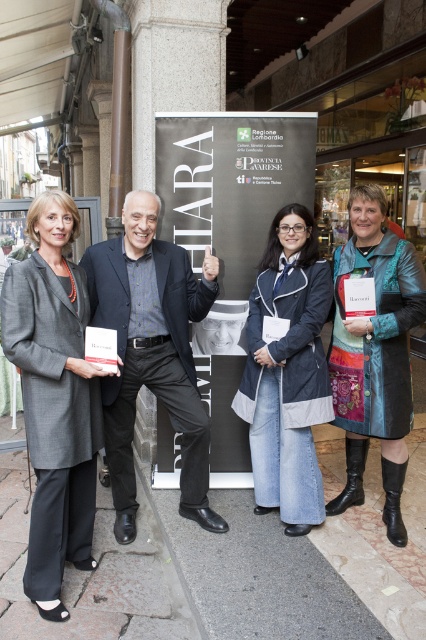
Does matte gray coat at center have a smaller size compared to dark gray suit at center?

Yes.

Is point (66, 230) more distant than point (131, 445)?

No, it is in front of (131, 445).

Is point (63, 376) closer to camera compared to point (126, 524)?

That is True.

Identify the location of matte gray coat at center. [x=54, y=397].

Is matte gray coat at center closer to camera compared to leather jacket at center?

Yes, it is.

Who is lower down, matte gray coat at center or leather jacket at center?

Positioned lower is matte gray coat at center.

Which is behind, point (37, 515) or point (340, 317)?

Positioned behind is point (340, 317).

Where is `matte gray coat at center`? matte gray coat at center is located at coordinates (54, 397).

Does white paper at center have a greater height compared to leather jacket at center?

Yes.

Does white paper at center have a larger size compared to leather jacket at center?

Yes.

Who is more forward, (178, 188) or (377, 339)?

Point (377, 339) is in front.

Where is `white paper at center`? This screenshot has height=640, width=426. white paper at center is located at coordinates (229, 234).